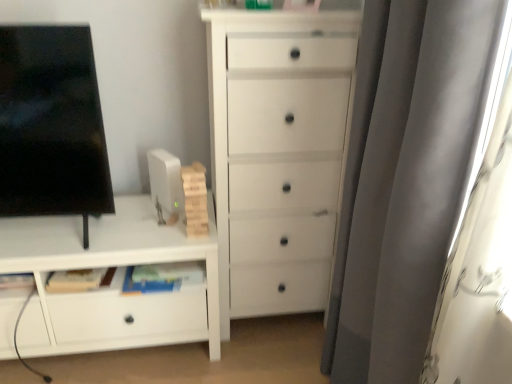
Locate an element on the screen. gray velvet curtain at right is located at coordinates (412, 175).

What is the approximate width of gray velvet curtain at right?

It is 9.23 inches.

How much space does white matte chest of drawers at center, which is the 2th chest of drawers from left to right, occupy vertically?

1.32 meters.

This screenshot has height=384, width=512. Find the location of `white matte cabinet at lower left, the second chest of drawers viewed from the right`. white matte cabinet at lower left, the second chest of drawers viewed from the right is located at coordinates (110, 289).

Find the location of a particular element. This screenshot has width=512, height=384. gray velvet curtain at right is located at coordinates (412, 175).

Do you think gray velvet curtain at right is within white matte cabinet at lower left, the second chest of drawers viewed from the right, or outside of it?

gray velvet curtain at right is not enclosed by white matte cabinet at lower left, the second chest of drawers viewed from the right.

Could you tell me if gray velvet curtain at right is facing white matte cabinet at lower left, the second chest of drawers viewed from the right?

Yes, gray velvet curtain at right is oriented towards white matte cabinet at lower left, the second chest of drawers viewed from the right.

Is gray velvet curtain at right at the right side of white matte cabinet at lower left, which ranks as the 1th chest of drawers in left-to-right order?

Indeed, gray velvet curtain at right is positioned on the right side of white matte cabinet at lower left, which ranks as the 1th chest of drawers in left-to-right order.

From a real-world perspective, is gray velvet curtain at right over white matte cabinet at lower left, the second chest of drawers viewed from the right?

Yes, from a real-world perspective, gray velvet curtain at right is over white matte cabinet at lower left, the second chest of drawers viewed from the right

Is white matte chest of drawers at center, the 1th chest of drawers from the right, wider than black glossy screen at left?

Indeed, white matte chest of drawers at center, the 1th chest of drawers from the right, has a greater width compared to black glossy screen at left.

From the image's perspective, is white matte chest of drawers at center, which is the 2th chest of drawers from left to right, above black glossy screen at left?

Actually, white matte chest of drawers at center, which is the 2th chest of drawers from left to right, appears below black glossy screen at left in the image.

Is point (323, 137) positioned behind point (59, 158)?

Yes, point (323, 137) is farther from viewer.

Is black glossy screen at left at the back of white matte chest of drawers at center, which is the 2th chest of drawers from left to right?

No.

From a real-world perspective, between black glossy screen at left and gray velvet curtain at right, who is vertically higher?

From a 3D spatial view, black glossy screen at left is above.

Find the location of a particular element. The image size is (512, 384). curtain on the right of black glossy screen at left is located at coordinates (412, 175).

From the picture: Is black glossy screen at left not inside gray velvet curtain at right?

Indeed, black glossy screen at left is completely outside gray velvet curtain at right.

Identify the location of screen on the left of white matte chest of drawers at center, the 1th chest of drawers from the right. Image resolution: width=512 pixels, height=384 pixels. (51, 124).

Between black glossy screen at left and white matte chest of drawers at center, which is the 2th chest of drawers from left to right, which one has smaller size?

With smaller size is black glossy screen at left.

Between point (42, 74) and point (274, 94), which one is positioned in front?

The point (42, 74) is in front.

Does white matte cabinet at lower left, the second chest of drawers viewed from the right, have a greater width compared to gray velvet curtain at right?

Yes, white matte cabinet at lower left, the second chest of drawers viewed from the right, is wider than gray velvet curtain at right.

Is white matte cabinet at lower left, the second chest of drawers viewed from the right, outside of gray velvet curtain at right?

Yes, white matte cabinet at lower left, the second chest of drawers viewed from the right, is not within gray velvet curtain at right.

Looking at the image, does white matte cabinet at lower left, which ranks as the 1th chest of drawers in left-to-right order, seem bigger or smaller compared to gray velvet curtain at right?

In the image, white matte cabinet at lower left, which ranks as the 1th chest of drawers in left-to-right order, appears to be larger than gray velvet curtain at right.

Can you confirm if white matte cabinet at lower left, which ranks as the 1th chest of drawers in left-to-right order, is positioned to the right of gray velvet curtain at right?

No.

Is gray velvet curtain at right beside white matte chest of drawers at center, the 1th chest of drawers from the right?

No, gray velvet curtain at right is not next to white matte chest of drawers at center, the 1th chest of drawers from the right.

Image resolution: width=512 pixels, height=384 pixels. Find the location of `curtain that appears below the white matte chest of drawers at center, the 1th chest of drawers from the right (from the image's perspective)`. curtain that appears below the white matte chest of drawers at center, the 1th chest of drawers from the right (from the image's perspective) is located at coordinates (412, 175).

In terms of height, does gray velvet curtain at right look taller or shorter compared to white matte chest of drawers at center, which is the 2th chest of drawers from left to right?

Clearly, gray velvet curtain at right is taller compared to white matte chest of drawers at center, which is the 2th chest of drawers from left to right.

Is gray velvet curtain at right bigger or smaller than white matte chest of drawers at center, which is the 2th chest of drawers from left to right?

Clearly, gray velvet curtain at right is smaller in size than white matte chest of drawers at center, which is the 2th chest of drawers from left to right.

Considering their positions, is gray velvet curtain at right located in front of or behind black glossy screen at left?

In the image, gray velvet curtain at right appears in front of black glossy screen at left.

From a real-world perspective, which object rests below the other?

gray velvet curtain at right, from a real-world perspective.

Is gray velvet curtain at right not close to black glossy screen at left?

gray velvet curtain at right is actually quite close to black glossy screen at left.

Image resolution: width=512 pixels, height=384 pixels. What are the coordinates of `curtain on the right of white matte cabinet at lower left, the second chest of drawers viewed from the right` in the screenshot? It's located at (412, 175).

Identify the location of screen in front of the white matte chest of drawers at center, the 1th chest of drawers from the right. This screenshot has height=384, width=512. (51, 124).

Considering their positions, is white matte chest of drawers at center, the 1th chest of drawers from the right, positioned closer to white matte cabinet at lower left, which ranks as the 1th chest of drawers in left-to-right order, than gray velvet curtain at right?

white matte chest of drawers at center, the 1th chest of drawers from the right.

When comparing their distances from white matte cabinet at lower left, which ranks as the 1th chest of drawers in left-to-right order, does black glossy screen at left or gray velvet curtain at right seem closer?

black glossy screen at left is positioned closer to the anchor white matte cabinet at lower left, which ranks as the 1th chest of drawers in left-to-right order.

Based on their spatial positions, is white matte chest of drawers at center, which is the 2th chest of drawers from left to right, or white matte cabinet at lower left, which ranks as the 1th chest of drawers in left-to-right order, further from black glossy screen at left?

white matte chest of drawers at center, which is the 2th chest of drawers from left to right, lies further to black glossy screen at left than the other object.

Looking at the image, which one is located closer to gray velvet curtain at right, black glossy screen at left or white matte chest of drawers at center, which is the 2th chest of drawers from left to right?

Based on the image, white matte chest of drawers at center, which is the 2th chest of drawers from left to right, appears to be nearer to gray velvet curtain at right.

Considering their positions, is gray velvet curtain at right positioned closer to black glossy screen at left than white matte cabinet at lower left, the second chest of drawers viewed from the right?

Based on the image, white matte cabinet at lower left, the second chest of drawers viewed from the right, appears to be nearer to black glossy screen at left.

Estimate the real-world distances between objects in this image. Which object is closer to black glossy screen at left, white matte chest of drawers at center, the 1th chest of drawers from the right, or gray velvet curtain at right?

white matte chest of drawers at center, the 1th chest of drawers from the right, is positioned closer to the anchor black glossy screen at left.

Estimate the real-world distances between objects in this image. Which object is closer to black glossy screen at left, white matte cabinet at lower left, the second chest of drawers viewed from the right, or white matte chest of drawers at center, the 1th chest of drawers from the right?

Among the two, white matte cabinet at lower left, the second chest of drawers viewed from the right, is located nearer to black glossy screen at left.

Looking at the image, which one is located further to white matte chest of drawers at center, which is the 2th chest of drawers from left to right, white matte cabinet at lower left, the second chest of drawers viewed from the right, or black glossy screen at left?

black glossy screen at left is positioned further to the anchor white matte chest of drawers at center, which is the 2th chest of drawers from left to right.

Locate an element on the screen. Image resolution: width=512 pixels, height=384 pixels. chest of drawers between white matte cabinet at lower left, which ranks as the 1th chest of drawers in left-to-right order, and gray velvet curtain at right, in the horizontal direction is located at coordinates (278, 152).

Where is `chest of drawers between black glossy screen at left and white matte chest of drawers at center, which is the 2th chest of drawers from left to right, in the horizontal direction`? chest of drawers between black glossy screen at left and white matte chest of drawers at center, which is the 2th chest of drawers from left to right, in the horizontal direction is located at coordinates (110, 289).